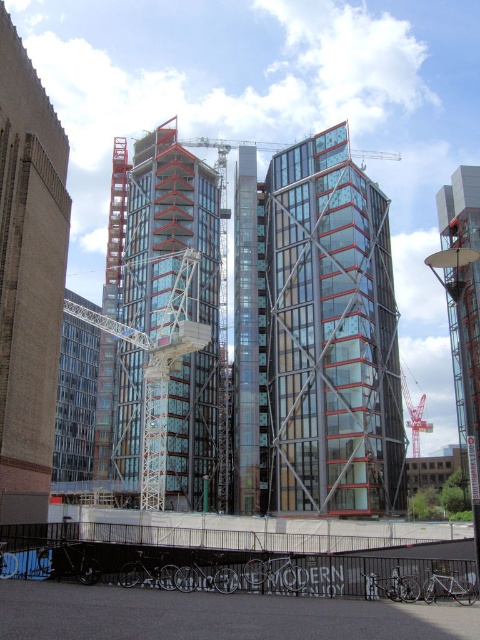
Question: Can you confirm if metallic scaffolding at lower center is positioned to the right of brick wall at left?

Choices:
 (A) no
 (B) yes

Answer: (B)

Question: Is metallic scaffolding at lower center positioned in front of brick wall at left?

Choices:
 (A) no
 (B) yes

Answer: (B)

Question: Which object is positioned farthest from the red metal crane at center?

Choices:
 (A) glassy steel tower at center
 (B) brick wall at left
 (C) metallic scaffolding at lower center
 (D) glassy steel building at center

Answer: (B)

Question: Which of these objects is positioned closest to the metallic scaffolding at lower center?

Choices:
 (A) glassy steel building at center
 (B) brick wall at left

Answer: (B)

Question: Considering the relative positions of glassy steel building at center and red metal crane at center in the image provided, where is glassy steel building at center located with respect to red metal crane at center?

Choices:
 (A) left
 (B) right

Answer: (A)

Question: Which point is farther to the camera?

Choices:
 (A) (414, 417)
 (B) (369, 451)
 (C) (27, 268)

Answer: (A)